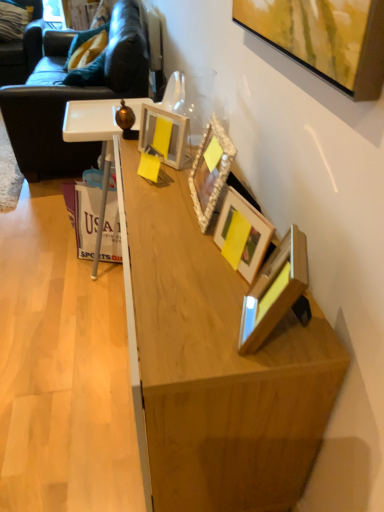
The image size is (384, 512). I want to click on empty space that is ontop of natural wood cabinet at center (from a real-world perspective), so click(54, 305).